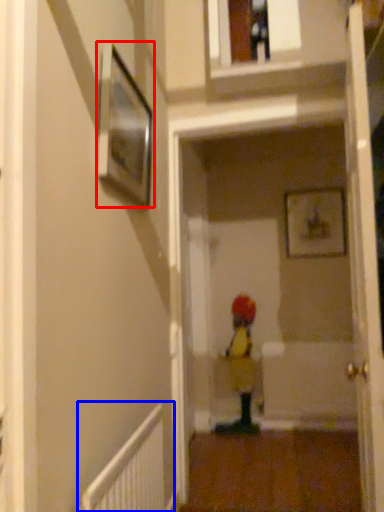
Question: Which of the following is the closest to the observer, picture frame (highlighted by a red box) or radiator (highlighted by a blue box)?

Choices:
 (A) picture frame
 (B) radiator

Answer: (B)